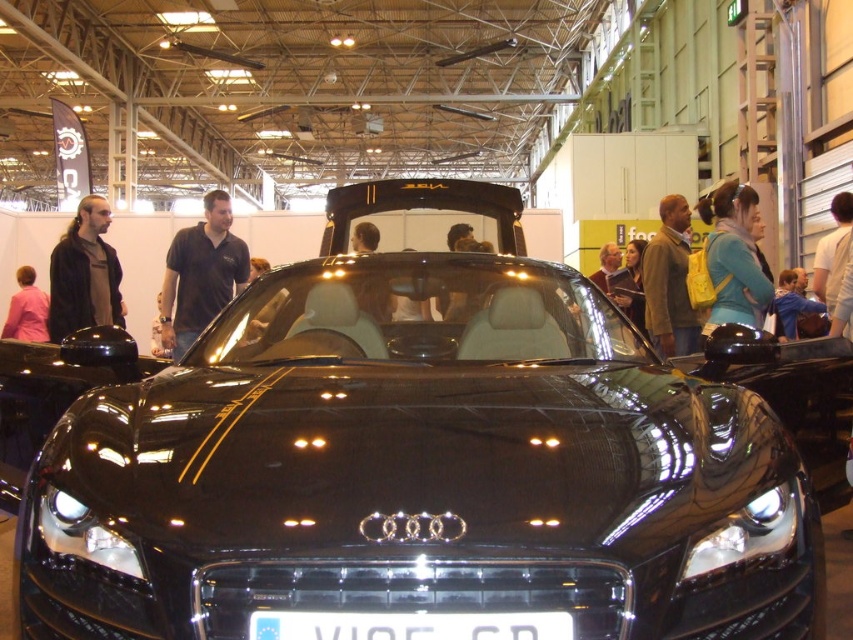
Question: Among these points, which one is farthest from the camera?

Choices:
 (A) (662, 198)
 (B) (781, 330)
 (C) (831, 275)

Answer: (B)

Question: Which point is closer to the camera?

Choices:
 (A) (540, 484)
 (B) (80, 292)
 (C) (669, 228)
 (D) (225, 280)

Answer: (A)

Question: Is black shirt at center thinner than brown leather jacket at upper right?

Choices:
 (A) yes
 (B) no

Answer: (B)

Question: Which point is closer to the camera?

Choices:
 (A) blue fabric jacket at upper right
 (B) dark brown leather jacket at left
 (C) blue fabric jacket at center
 (D) pink fabric at lower left

Answer: (A)

Question: Can you confirm if black shirt at center is smaller than white plastic license plate at center?

Choices:
 (A) no
 (B) yes

Answer: (A)

Question: Is black shirt at center below blue fabric jacket at center?

Choices:
 (A) yes
 (B) no

Answer: (B)